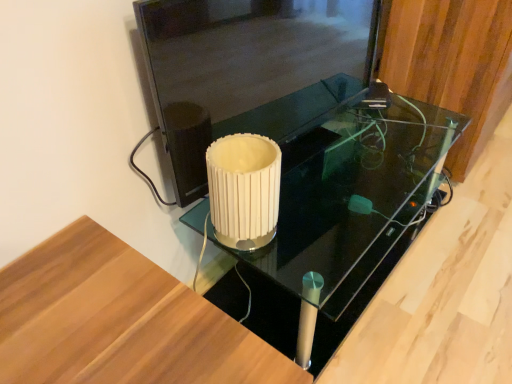
What do you see at coordinates (342, 217) in the screenshot? This screenshot has width=512, height=384. I see `black glass table at center` at bounding box center [342, 217].

What do you see at coordinates (253, 73) in the screenshot?
I see `transparent glass door at center` at bounding box center [253, 73].

What is the approximate height of white ribbed glass at center?

It is 8.05 inches.

You are a GUI agent. You are given a task and a screenshot of the screen. Output one action in this format:
    pyautogui.click(x=<x>, y=<y>)
    Task: Click on the wooden panel at upper right
    The width and height of the screenshot is (512, 384).
    Given the screenshot: What is the action you would take?
    pyautogui.click(x=453, y=64)

Locate an element on the screen. black glass table at center is located at coordinates (342, 217).

Can you confirm if white ribbed glass at center is positioned to the left of wooden panel at upper right?

Correct, you'll find white ribbed glass at center to the left of wooden panel at upper right.

Looking at this image, do you think white ribbed glass at center is within wooden panel at upper right, or outside of it?

white ribbed glass at center is outside wooden panel at upper right.

From the image's perspective, which is above, white ribbed glass at center or wooden panel at upper right?

wooden panel at upper right appears higher in the image.

Who is more distant, white ribbed glass at center or wooden panel at upper right?

wooden panel at upper right is more distant.

Is black glass table at center smaller than white ribbed glass at center?

Actually, black glass table at center might be larger than white ribbed glass at center.

Is black glass table at center in contact with white ribbed glass at center?

black glass table at center and white ribbed glass at center are clearly separated.

From the image's perspective, is black glass table at center over white ribbed glass at center?

No.

Identify the location of candle holder that appears above the black glass table at center (from the image's perspective). (244, 189).

Which of these two, transparent glass door at center or black glass table at center, is thinner?

With smaller width is transparent glass door at center.

How different are the orientations of transparent glass door at center and black glass table at center in degrees?

The angle between the facing direction of transparent glass door at center and the facing direction of black glass table at center is 9.82 degrees.

From the image's perspective, is transparent glass door at center above black glass table at center?

Indeed, from the image's perspective, transparent glass door at center is shown above black glass table at center.

Which is correct: wooden panel at upper right is inside transparent glass door at center, or outside of it?

wooden panel at upper right is spatially situated outside transparent glass door at center.

Which object is closer to the camera, wooden panel at upper right or transparent glass door at center?

transparent glass door at center is more forward.

What's the angular difference between wooden panel at upper right and transparent glass door at center's facing directions?

They differ by 10.5 degrees in their facing directions.

Considering the sizes of transparent glass door at center and wooden panel at upper right in the image, is transparent glass door at center wider or thinner than wooden panel at upper right?

In the image, transparent glass door at center appears to be more narrow than wooden panel at upper right.

Is transparent glass door at center bigger or smaller than wooden panel at upper right?

Considering their sizes, transparent glass door at center takes up less space than wooden panel at upper right.

From the image's perspective, is transparent glass door at center on top of wooden panel at upper right?

No, from the image's perspective, transparent glass door at center is not on top of wooden panel at upper right.

Considering the sizes of objects white ribbed glass at center and transparent glass door at center in the image provided, who is thinner, white ribbed glass at center or transparent glass door at center?

With smaller width is transparent glass door at center.

Does white ribbed glass at center have a larger size compared to transparent glass door at center?

No.

From the image's perspective, which object appears higher, white ribbed glass at center or transparent glass door at center?

transparent glass door at center, from the image's perspective.

Based on the photo, which is nearer, [236,139] or [274,52]?

The point [236,139] is in front.

Is the position of white ribbed glass at center less distant than that of black glass table at center?

Yes, it is.

Is white ribbed glass at center turned away from black glass table at center?

No, white ribbed glass at center is not facing the opposite direction of black glass table at center.

Is point (234, 238) closer to camera compared to point (373, 288)?

Yes, point (234, 238) is in front of point (373, 288).

Is white ribbed glass at center wider or thinner than black glass table at center?

Considering their sizes, white ribbed glass at center looks slimmer than black glass table at center.

Locate an element on the screen. This screenshot has width=512, height=384. candle holder in front of the wooden panel at upper right is located at coordinates (244, 189).

Where is `table below the white ribbed glass at center (from a real-world perspective)`? The image size is (512, 384). table below the white ribbed glass at center (from a real-world perspective) is located at coordinates (342, 217).

Looking at the image, which one is located further to wooden panel at upper right, black glass table at center or white ribbed glass at center?

Based on the image, white ribbed glass at center appears to be further to wooden panel at upper right.

From the image, which object appears to be nearer to wooden panel at upper right, black glass table at center or transparent glass door at center?

The object closer to wooden panel at upper right is black glass table at center.

Estimate the real-world distances between objects in this image. Which object is closer to transparent glass door at center, white ribbed glass at center or black glass table at center?

white ribbed glass at center lies closer to transparent glass door at center than the other object.

When comparing their distances from black glass table at center, does wooden panel at upper right or white ribbed glass at center seem further?

Based on the image, white ribbed glass at center appears to be further to black glass table at center.

Looking at the image, which one is located closer to black glass table at center, white ribbed glass at center or transparent glass door at center?

transparent glass door at center is positioned closer to the anchor black glass table at center.

Based on their spatial positions, is white ribbed glass at center or wooden panel at upper right closer to black glass table at center?

wooden panel at upper right is positioned closer to the anchor black glass table at center.

Estimate the real-world distances between objects in this image. Which object is closer to transparent glass door at center, black glass table at center or white ribbed glass at center?

white ribbed glass at center is positioned closer to the anchor transparent glass door at center.

Which object lies further to the anchor point black glass table at center, wooden panel at upper right or transparent glass door at center?

wooden panel at upper right lies further to black glass table at center than the other object.

Where is `glass door between white ribbed glass at center and wooden panel at upper right`? glass door between white ribbed glass at center and wooden panel at upper right is located at coordinates (253, 73).

Where is `table situated between white ribbed glass at center and wooden panel at upper right from left to right`? The height and width of the screenshot is (384, 512). table situated between white ribbed glass at center and wooden panel at upper right from left to right is located at coordinates click(x=342, y=217).

I want to click on table between transparent glass door at center and wooden panel at upper right from left to right, so click(342, 217).

Where is `candle holder between transparent glass door at center and black glass table at center from top to bottom`? candle holder between transparent glass door at center and black glass table at center from top to bottom is located at coordinates (244, 189).